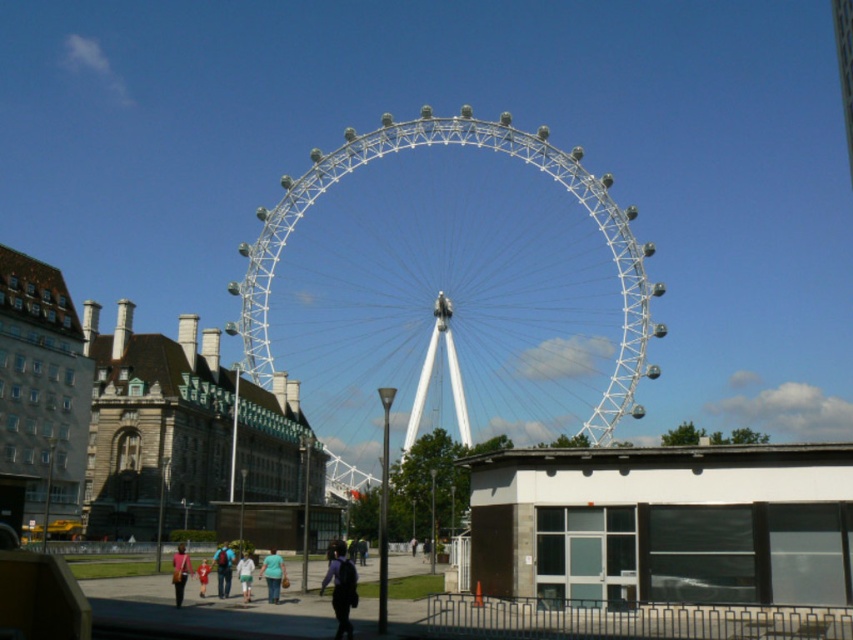
Question: Does white metallic ferris wheel at center lie in front of light blue jeans at center?

Choices:
 (A) no
 (B) yes

Answer: (A)

Question: Is dark blue backpack at lower center to the left of light blue jeans at center from the viewer's perspective?

Choices:
 (A) yes
 (B) no

Answer: (B)

Question: Which is farther from the white cotton shirt at center?

Choices:
 (A) white metallic ferris wheel at center
 (B) light blue jeans at center
 (C) red cotton shirt at lower center
 (D) matte pink backpack at lower left

Answer: (A)

Question: Is dark blue backpack at lower center smaller than matte pink backpack at lower left?

Choices:
 (A) no
 (B) yes

Answer: (B)

Question: Estimate the real-world distances between objects in this image. Which object is farther from the white metallic ferris wheel at center?

Choices:
 (A) red cotton shirt at lower center
 (B) light blue jeans at center
 (C) white cotton shirt at center
 (D) light blue shirt at center

Answer: (A)

Question: Which point appears farthest from the camera in this image?

Choices:
 (A) (225, 576)
 (B) (473, 132)
 (C) (202, 560)

Answer: (B)